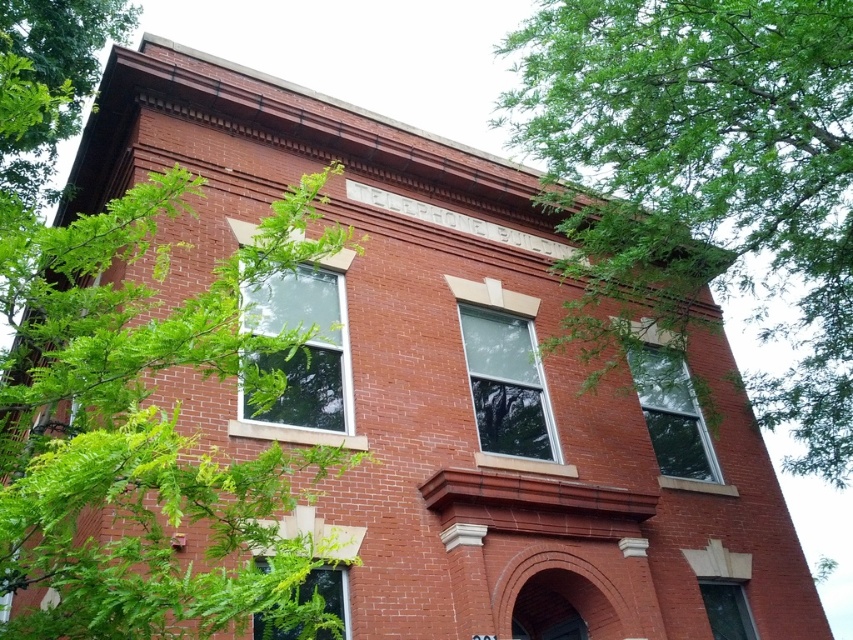
Question: Among these points, which one is nearest to the camera?

Choices:
 (A) (85, 224)
 (B) (648, 145)

Answer: (A)

Question: Is green leafy tree at upper left to the left of green leafy tree at upper right from the viewer's perspective?

Choices:
 (A) yes
 (B) no

Answer: (A)

Question: Which point is farther to the camera?

Choices:
 (A) (119, 220)
 (B) (699, 394)

Answer: (B)

Question: Is green leafy tree at upper left positioned behind green leafy tree at upper right?

Choices:
 (A) yes
 (B) no

Answer: (B)

Question: Which point is closer to the camera taking this photo?

Choices:
 (A) (99, 598)
 (B) (817, 381)

Answer: (A)

Question: Can you confirm if green leafy tree at upper left is smaller than green leafy tree at upper right?

Choices:
 (A) yes
 (B) no

Answer: (B)